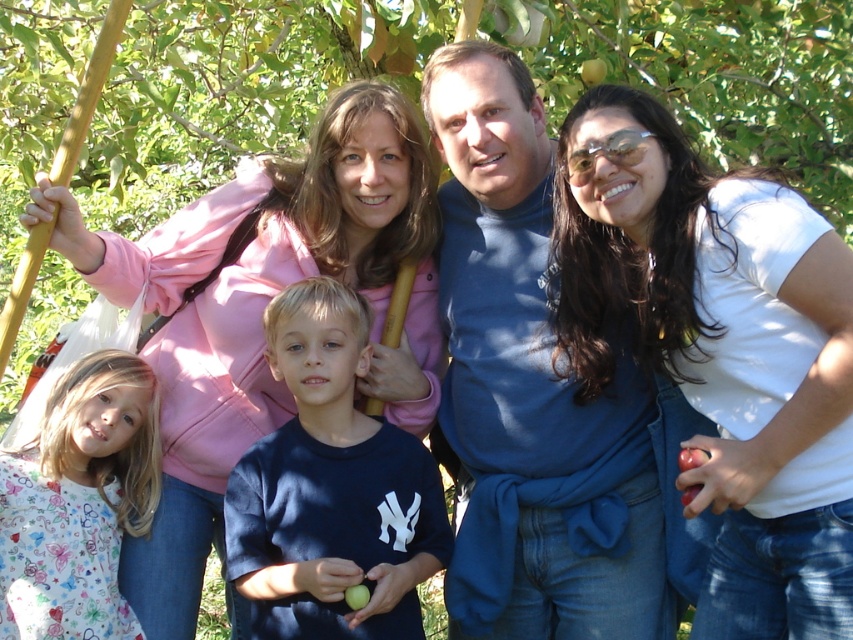
Based on the photo, is white matte shirt at upper right in front of pink fleece jacket at upper left?

That is True.

Can you confirm if white matte shirt at upper right is positioned above pink fleece jacket at upper left?

No, white matte shirt at upper right is not above pink fleece jacket at upper left.

Between point (779, 320) and point (392, 113), which one is positioned behind?

The point (392, 113) is behind.

Image resolution: width=853 pixels, height=640 pixels. Identify the location of white matte shirt at upper right. (721, 349).

Between green leafy tree at center and printed cotton shirt at lower left, which one is positioned lower?

Positioned lower is printed cotton shirt at lower left.

Between green leafy tree at center and printed cotton shirt at lower left, which one is positioned higher?

green leafy tree at center is above.

Between point (712, 51) and point (126, 365), which one is positioned in front?

Point (126, 365) is more forward.

You are a GUI agent. You are given a task and a screenshot of the screen. Output one action in this format:
    pyautogui.click(x=<x>, y=<y>)
    Task: Click on the green leafy tree at center
    The height and width of the screenshot is (640, 853).
    Given the screenshot: What is the action you would take?
    pyautogui.click(x=233, y=90)

Locate an element on the screen. The width and height of the screenshot is (853, 640). blue cotton shirt at center is located at coordinates (531, 392).

Locate an element on the screen. This screenshot has height=640, width=853. blue cotton shirt at center is located at coordinates (531, 392).